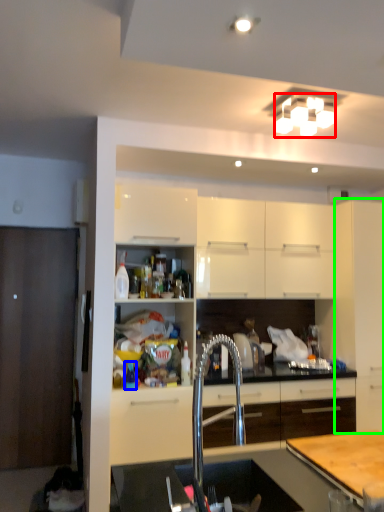
Question: Which object is positioned farthest from light fixture (highlighted by a red box)? Select from bottle (highlighted by a blue box) and cabinetry (highlighted by a green box).

Choices:
 (A) bottle
 (B) cabinetry

Answer: (A)